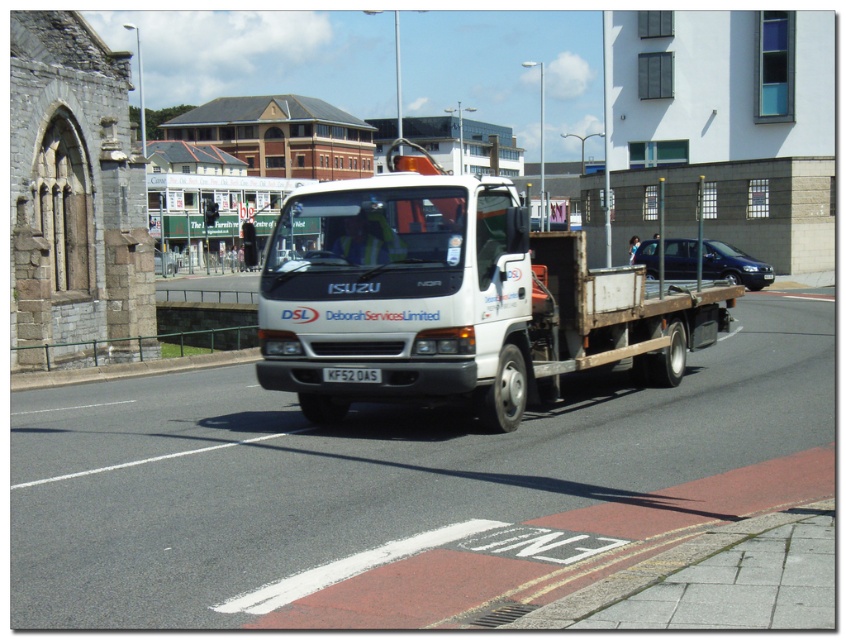
You are a pedestrian standing at the pedestrian crossing at the bottom right corner of the frame. You see a dark blue metallic van at center and a white plastic license plate at center. Which object is closer to you?

The dark blue metallic van at center is closer to you because the white plastic license plate at center is behind it.

You are a pedestrian standing at the pedestrian crossing at the bottom right corner of the frame. You see the white matte truck at center and the dark blue metallic van at center. Which vehicle is closer to you?

The white matte truck at center is closer to you because it is positioned under the dark blue metallic van at center, indicating it is in front of the van and thus nearer to your position at the pedestrian crossing.